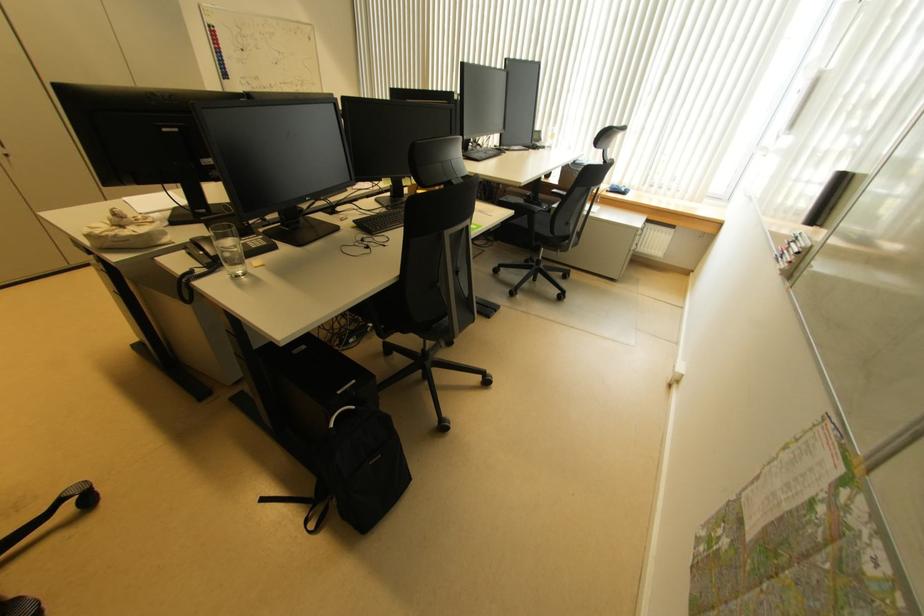
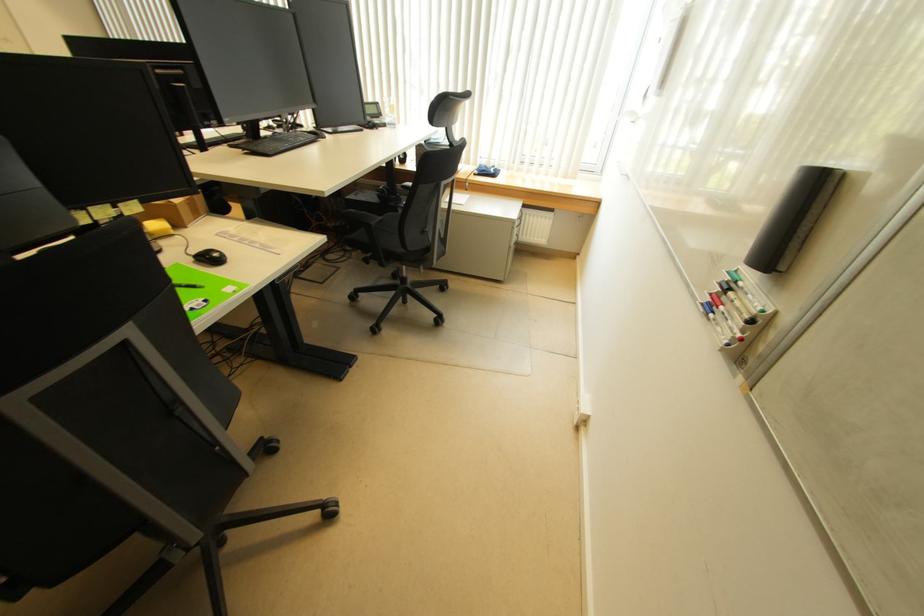
Find the pixel in the second image that matches (792,262) in the first image.

(742, 338)